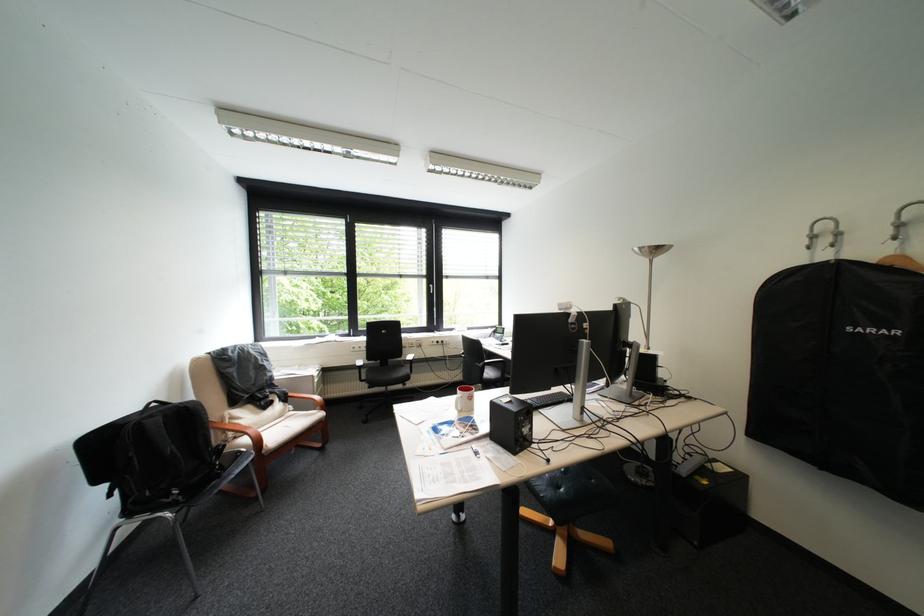
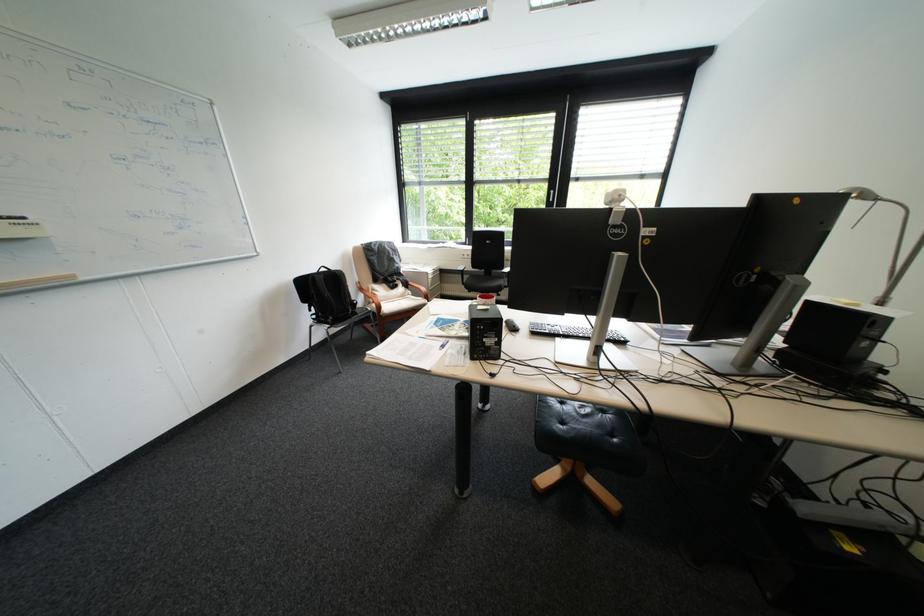
How did the camera likely rotate?

The camera's rotation is toward left-down.